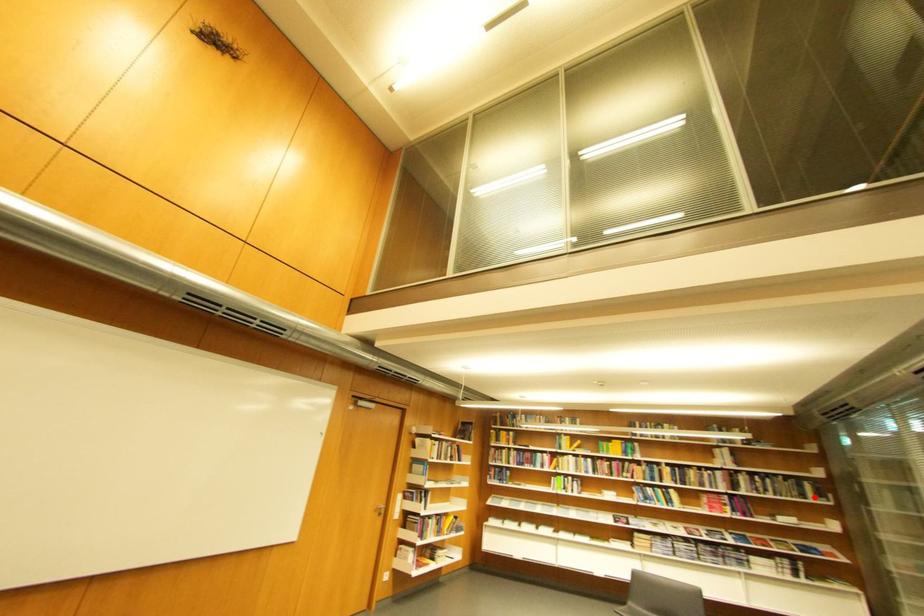
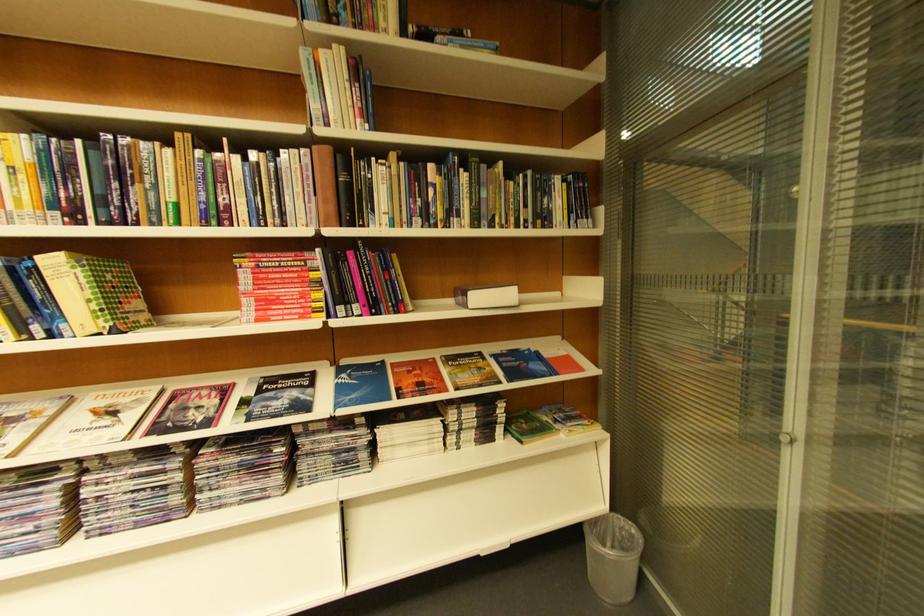
Question: I am providing you with two images of the same scene from different viewpoints. A red point is marked on the first image. Can you still see the location of the red point in image 2?

Choices:
 (A) Yes
 (B) No

Answer: (A)